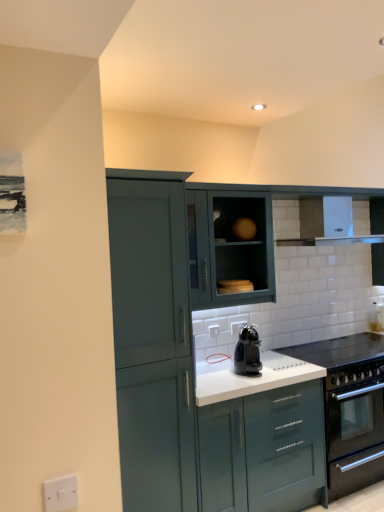
Question: In terms of width, does matte teal cabinet at center, arranged as the 2th cabinetry when viewed from the front, look wider or thinner when compared to black plastic coffee machine at center?

Choices:
 (A) wide
 (B) thin

Answer: (A)

Question: Is matte teal cabinet at center, arranged as the 2th cabinetry when viewed from the front, spatially inside black plastic coffee machine at center, or outside of it?

Choices:
 (A) outside
 (B) inside

Answer: (A)

Question: Based on their relative distances, which object is farther from the matte green cabinet at upper center, marked as the fourth cabinetry in a front-to-back arrangement?

Choices:
 (A) white plastic electric outlet at lower left
 (B) white glossy countertop at center
 (C) matte teal cabinet at left, the first cabinetry from the front
 (D) white glossy exhaust hood at upper right
 (E) black plastic coffee machine at center

Answer: (A)

Question: Based on their relative distances, which object is farther from the white glossy countertop at center?

Choices:
 (A) matte green cabinet at upper center, arranged as the 1th cabinetry when viewed from the back
 (B) matte teal cabinet at left, arranged as the fourth cabinetry when viewed from the back
 (C) matte teal cabinet at center, arranged as the 2th cabinetry when viewed from the front
 (D) white plastic electric outlet at lower left
 (E) black plastic coffee machine at center

Answer: (D)